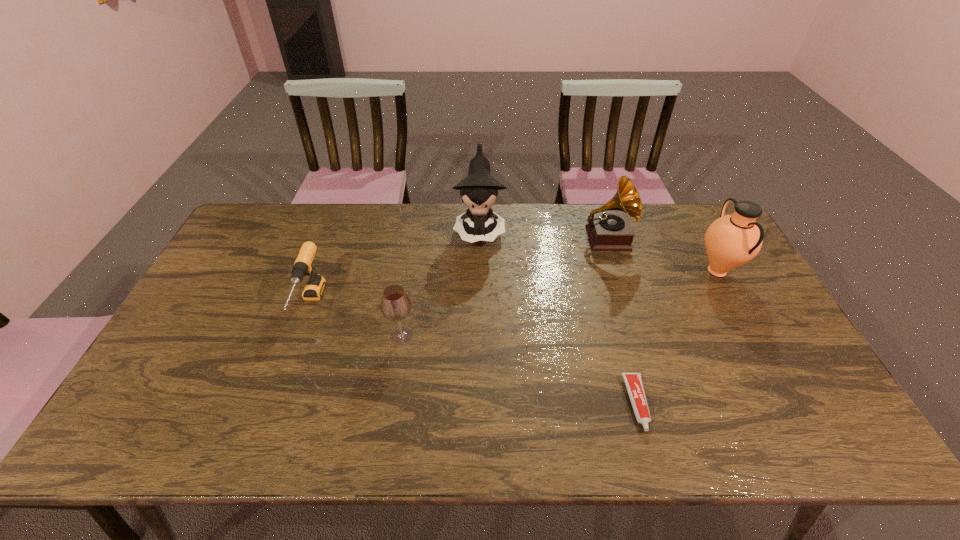
What are the coordinates of `doll` in the screenshot? It's located at (479, 189).

Locate an element on the screen. This screenshot has width=960, height=540. phonograph record is located at coordinates (606, 230).

Find the location of `the rightmost object`. the rightmost object is located at coordinates coord(732,240).

Locate an element on the screen. wineglass is located at coordinates (396, 305).

Find the location of a particular element. the fifth tallest object is located at coordinates (314, 288).

Where is `the leftmost object`? the leftmost object is located at coordinates (314, 288).

Identify the location of the nearest object. (633, 382).

The height and width of the screenshot is (540, 960). Find the location of `toothpaste`. toothpaste is located at coordinates (633, 382).

Where is `free region located 0.280m at the face of the fourth object from right to left`? The width and height of the screenshot is (960, 540). free region located 0.280m at the face of the fourth object from right to left is located at coordinates (479, 318).

Where is `vacant region located 0.170m from the horn of the phonograph record`? The height and width of the screenshot is (540, 960). vacant region located 0.170m from the horn of the phonograph record is located at coordinates (626, 300).